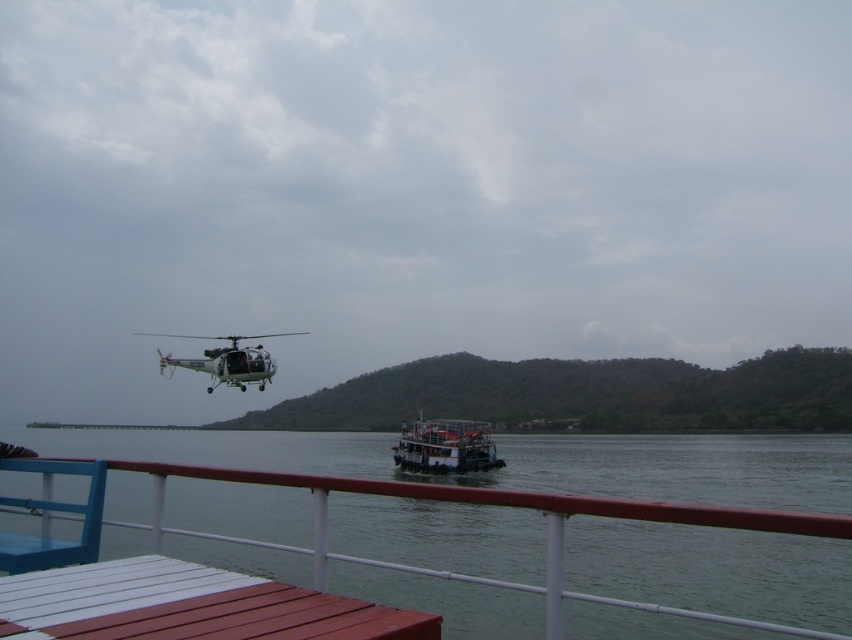
You are a passenger on the boat and want to take a photo of the white matte helicopter at upper center. Since the green water at lower center is in the way, can you adjust your position to avoid it?

The green water at lower center is larger than the white matte helicopter at upper center, so you can move to the right side of the boat to avoid the green water at lower center blocking the view of the helicopter.

Based on the coordinates provided in the description, where is the white matte boat at center located in the image?

The white matte boat at center is located at coordinates point (445, 445).